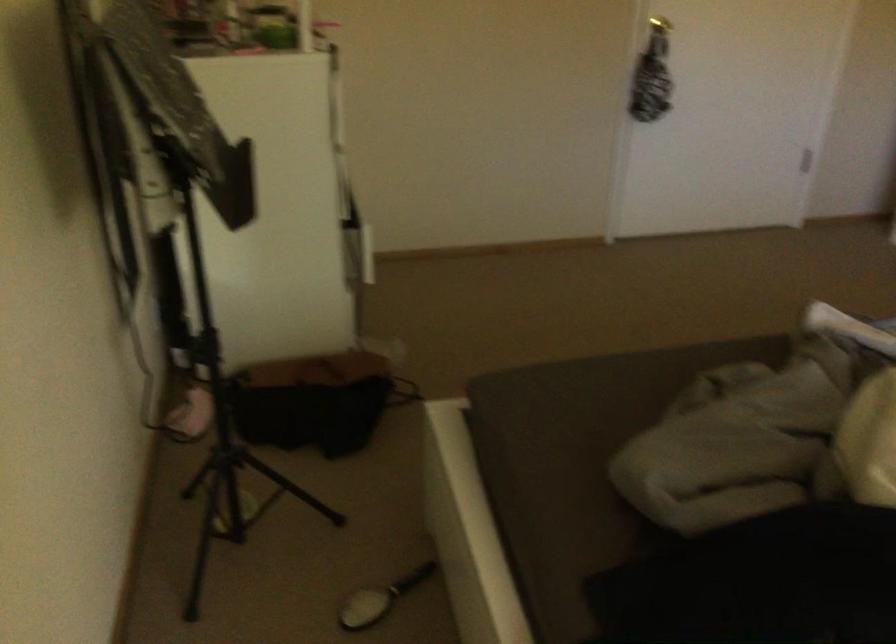
Where would you lift the hanging scarf? Please return your answer as a coordinate pair (x, y).

(649, 87)